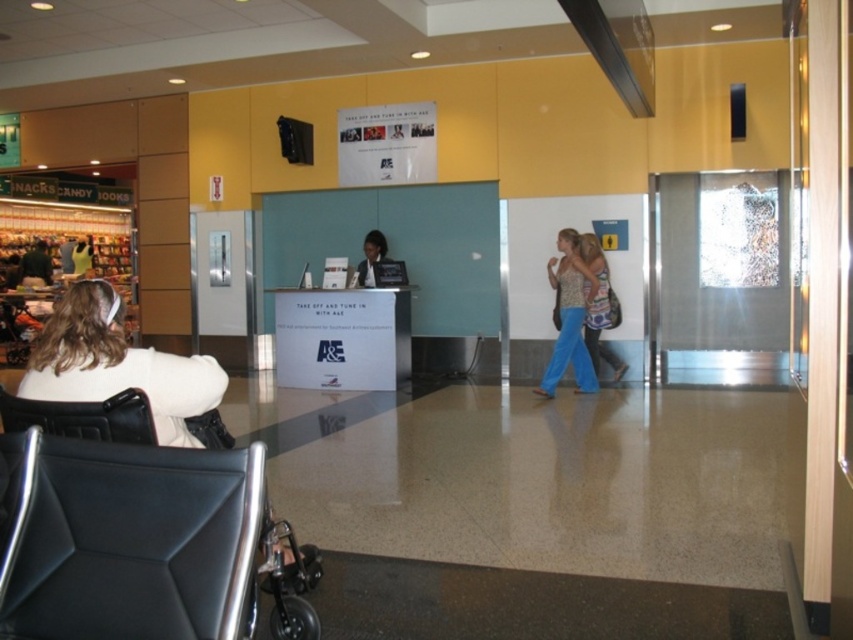
Question: Can you confirm if patterned fabric dress at center is smaller than matte black laptop at center?

Choices:
 (A) no
 (B) yes

Answer: (A)

Question: Does black leather swivel chair at lower left appear under patterned fabric dress at center?

Choices:
 (A) no
 (B) yes

Answer: (B)

Question: Based on their relative distances, which object is farther from the black leather swivel chair at lower left?

Choices:
 (A) matte black jacket at left
 (B) patterned fabric top at center
 (C) matte black laptop at center

Answer: (A)

Question: Which point is closer to the camera?

Choices:
 (A) patterned fabric top at center
 (B) black leather swivel chair at lower left

Answer: (B)

Question: Estimate the real-world distances between objects in this image. Which object is farther from the black leather swivel chair at lower left?

Choices:
 (A) black leather chair at lower left
 (B) matte black laptop at center
 (C) patterned fabric top at center
 (D) matte black jacket at left

Answer: (D)

Question: Is patterned fabric top at center bigger than patterned fabric dress at center?

Choices:
 (A) no
 (B) yes

Answer: (B)